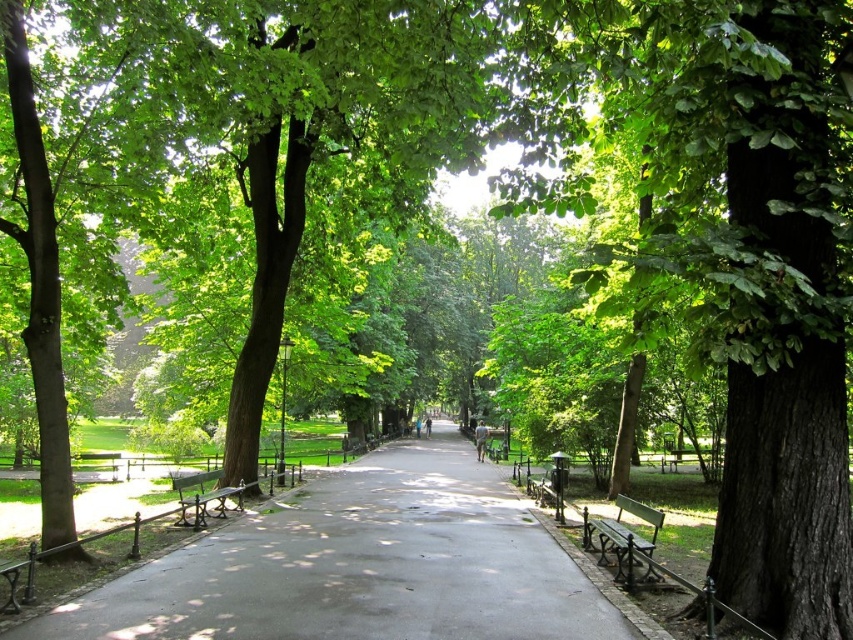
Question: Observing the image, what is the correct spatial positioning of green wooden bench at right in reference to wooden bench at center?

Choices:
 (A) right
 (B) left

Answer: (A)

Question: Can you confirm if wooden bench at center is smaller than wooden park bench at center?

Choices:
 (A) yes
 (B) no

Answer: (A)

Question: Which point is farther from the camera taking this photo?

Choices:
 (A) (599, 525)
 (B) (271, 477)

Answer: (B)

Question: Does wooden bench at center appear under wooden park bench at center?

Choices:
 (A) no
 (B) yes

Answer: (A)

Question: Which point is farther to the camera?

Choices:
 (A) (291, 483)
 (B) (633, 515)
 (C) (393, 506)
 (D) (177, 483)

Answer: (A)

Question: Which of the following is the farthest from the observer?

Choices:
 (A) (289, 464)
 (B) (630, 582)
 (C) (189, 480)

Answer: (A)